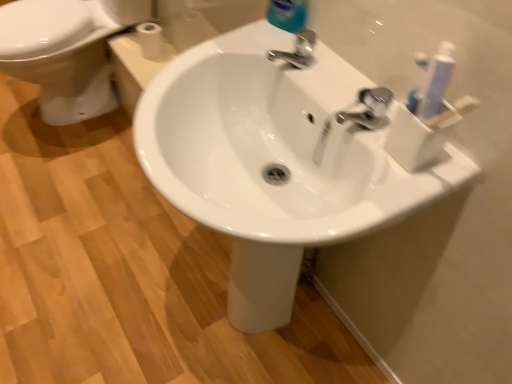
Where is `free space in front of white glossy bidet at left`? free space in front of white glossy bidet at left is located at coordinates (76, 179).